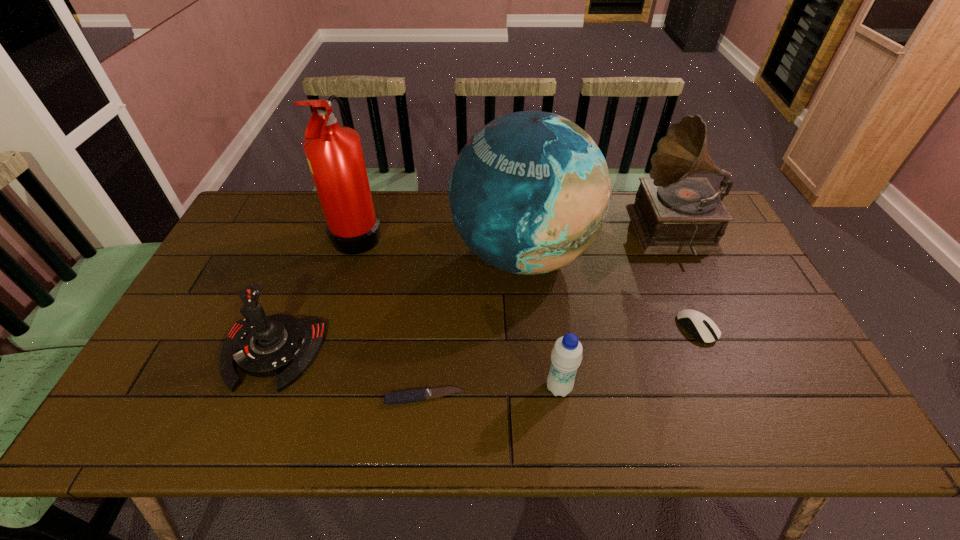
Identify the location of fire extinguisher. This screenshot has width=960, height=540. (334, 153).

Locate an element on the screen. This screenshot has width=960, height=540. globe is located at coordinates (529, 193).

Find the location of a particular element. record player is located at coordinates [x=672, y=214].

This screenshot has height=540, width=960. I want to click on joystick, so click(x=262, y=346).

Where is `water bottle`? This screenshot has width=960, height=540. water bottle is located at coordinates (566, 355).

At what (x,y) coordinates should I click in order to perform the action: click on mouse. Please return your answer as a coordinate pair (x, y). The image size is (960, 540). Looking at the image, I should click on (702, 328).

The height and width of the screenshot is (540, 960). Find the location of `the shortest object`. the shortest object is located at coordinates (401, 397).

Identify the location of free space located at the spray nozzle of the fire extinguisher. This screenshot has width=960, height=540. (467, 232).

Where is `free space located on the right of the globe`? This screenshot has width=960, height=540. free space located on the right of the globe is located at coordinates (671, 254).

Locate an element on the screen. free point located 0.190m from the horn of the record player is located at coordinates (578, 234).